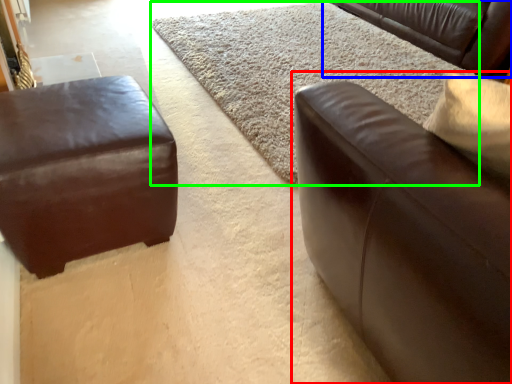
Question: Which is farther away from studio couch (highlighted by a red box)? studio couch (highlighted by a blue box) or mat (highlighted by a green box)?

Choices:
 (A) studio couch
 (B) mat

Answer: (A)